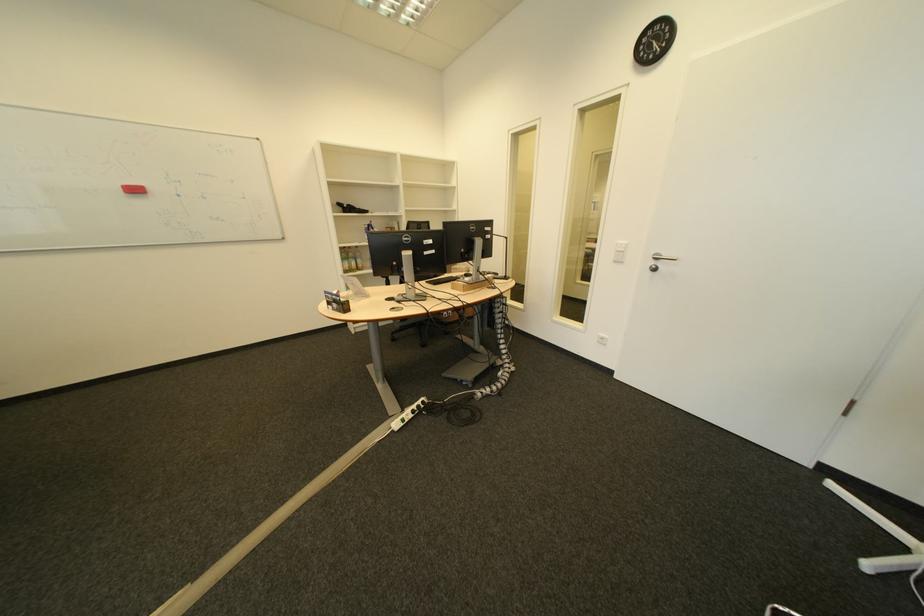
Describe the element at coordinates (348, 208) in the screenshot. I see `the telephone handset` at that location.